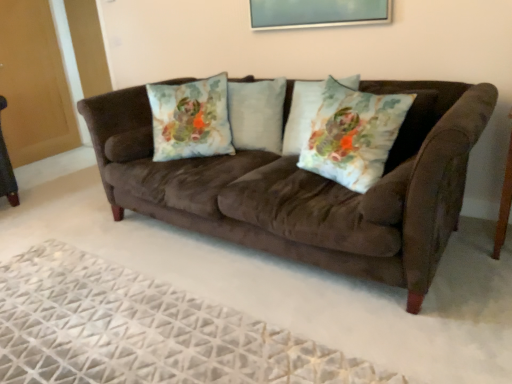
Question: Is fluffy white pillow at center, arranged as the 2th pillow when viewed from the right, closer to camera compared to suede couch at center?

Choices:
 (A) yes
 (B) no

Answer: (B)

Question: Does fluffy white pillow at center, which appears as the first pillow when viewed from the left, have a smaller size compared to suede couch at center?

Choices:
 (A) yes
 (B) no

Answer: (A)

Question: Is fluffy white pillow at center, which appears as the first pillow when viewed from the left, to the right of suede couch at center from the viewer's perspective?

Choices:
 (A) yes
 (B) no

Answer: (B)

Question: Is suede couch at center a part of fluffy white pillow at center, arranged as the 2th pillow when viewed from the right?

Choices:
 (A) yes
 (B) no

Answer: (B)

Question: Is fluffy white pillow at center, which appears as the first pillow when viewed from the left, at the left side of suede couch at center?

Choices:
 (A) no
 (B) yes

Answer: (B)

Question: Considering the positions of fluffy white pillow at center, which appears as the first pillow when viewed from the left, and white textured rug at lower center in the image, is fluffy white pillow at center, which appears as the first pillow when viewed from the left, wider or thinner than white textured rug at lower center?

Choices:
 (A) thin
 (B) wide

Answer: (A)

Question: Visually, is fluffy white pillow at center, arranged as the 2th pillow when viewed from the right, positioned to the left or to the right of white textured rug at lower center?

Choices:
 (A) right
 (B) left

Answer: (A)

Question: Relative to white textured rug at lower center, is fluffy white pillow at center, which appears as the first pillow when viewed from the left, in front or behind?

Choices:
 (A) behind
 (B) front

Answer: (A)

Question: Is fluffy white pillow at center, arranged as the 2th pillow when viewed from the right, taller or shorter than white textured rug at lower center?

Choices:
 (A) tall
 (B) short

Answer: (A)

Question: From the image's perspective, is floral fabric pillow at center, which is the first throw pillow in back-to-front order, above or below suede couch at center?

Choices:
 (A) below
 (B) above

Answer: (B)

Question: In the image, is floral fabric pillow at center, acting as the first throw pillow starting from the left, positioned in front of or behind suede couch at center?

Choices:
 (A) behind
 (B) front

Answer: (A)

Question: In the image, is floral fabric pillow at center, positioned as the 2th throw pillow in right-to-left order, on the left side or the right side of suede couch at center?

Choices:
 (A) right
 (B) left

Answer: (B)

Question: Looking at the image, does floral fabric pillow at center, acting as the first throw pillow starting from the left, seem bigger or smaller compared to suede couch at center?

Choices:
 (A) small
 (B) big

Answer: (A)

Question: Would you say white textured rug at lower center is inside or outside fluffy white pillow at center, arranged as the 2th pillow when viewed from the right?

Choices:
 (A) outside
 (B) inside

Answer: (A)

Question: Looking at their shapes, would you say white textured rug at lower center is wider or thinner than fluffy white pillow at center, which appears as the first pillow when viewed from the left?

Choices:
 (A) thin
 (B) wide

Answer: (B)